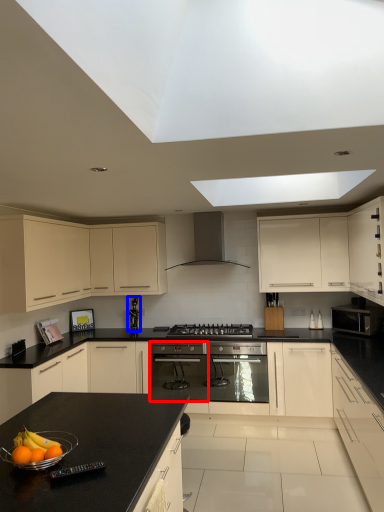
Question: Which point is closer to the camera, appliance (highlighted by a red box) or appliance (highlighted by a blue box)?

Choices:
 (A) appliance
 (B) appliance

Answer: (A)